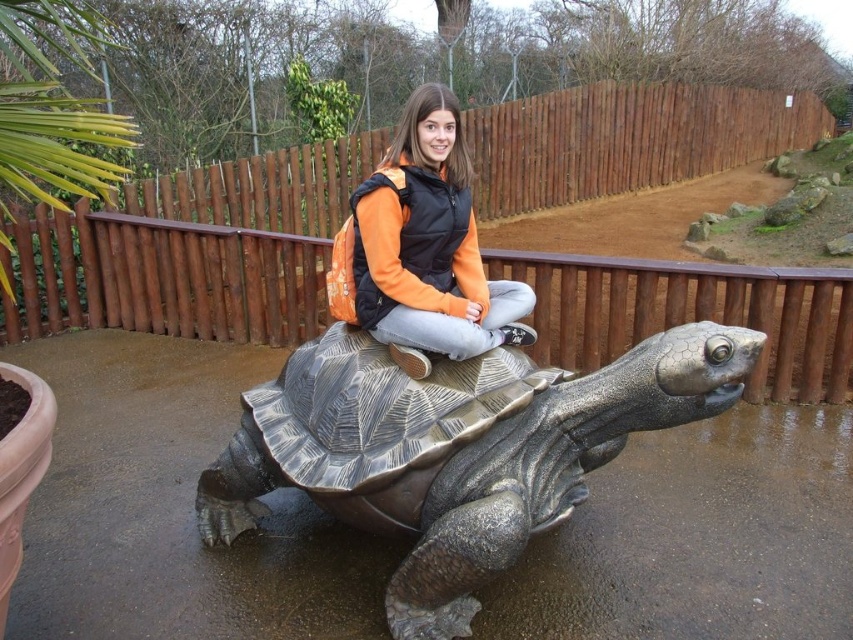
Question: Can you confirm if metallic tortoise at center is wider than orange fabric jacket at center?

Choices:
 (A) no
 (B) yes

Answer: (B)

Question: Which object is closer to the camera taking this photo?

Choices:
 (A) orange fabric jacket at center
 (B) metallic tortoise at center

Answer: (B)

Question: Which object appears farthest from the camera in this image?

Choices:
 (A) orange fabric jacket at center
 (B) metallic tortoise at center

Answer: (A)

Question: In this image, where is metallic tortoise at center located relative to orange fabric jacket at center?

Choices:
 (A) left
 (B) right

Answer: (A)

Question: Can you confirm if metallic tortoise at center is positioned to the right of orange fabric jacket at center?

Choices:
 (A) yes
 (B) no

Answer: (B)

Question: Which point is farther to the camera?

Choices:
 (A) metallic tortoise at center
 (B) orange fabric jacket at center

Answer: (B)